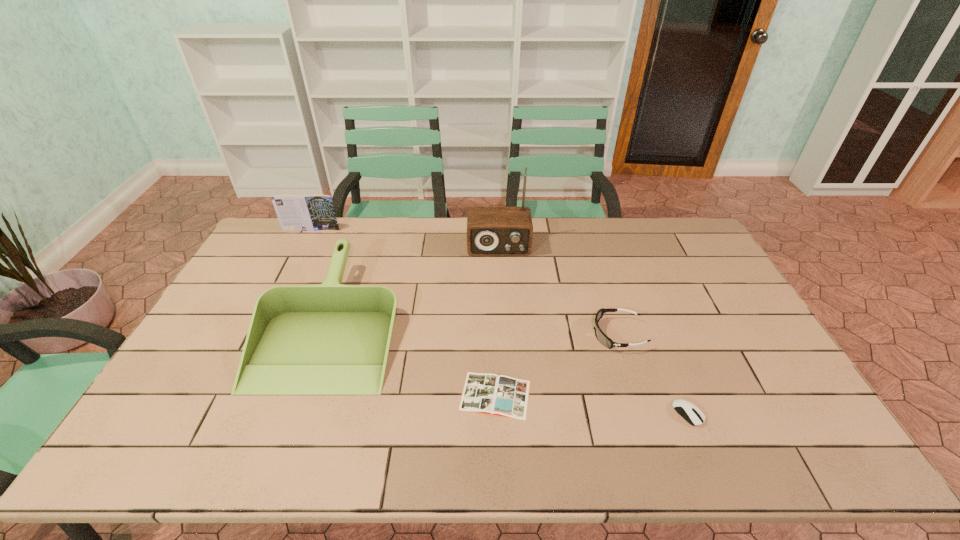
Locate an element on the screen. book situated at the far edge is located at coordinates (314, 212).

Locate an element on the screen. The height and width of the screenshot is (540, 960). book that is at the left edge is located at coordinates (314, 212).

Locate an element on the screen. The image size is (960, 540). dustpan located in the left edge section of the desktop is located at coordinates (329, 339).

This screenshot has width=960, height=540. Identify the location of object at the far left corner. (314, 212).

Find the location of `vacant space at the far edge of the desktop`. vacant space at the far edge of the desktop is located at coordinates (302, 246).

Find the location of a particular element. The image size is (960, 540). vacant space at the near edge of the desktop is located at coordinates (399, 443).

Locate an element on the screen. The height and width of the screenshot is (540, 960). free space at the left edge of the desktop is located at coordinates (176, 393).

Identify the location of free space at the right edge of the desktop. This screenshot has height=540, width=960. (736, 327).

Locate an element on the screen. The width and height of the screenshot is (960, 540). vacant space at the far right corner of the desktop is located at coordinates (649, 224).

At what (x,y) coordinates should I click in order to perform the action: click on free space between the left book and the fifth object from left to right. Please return your answer as a coordinate pair (x, y). Looking at the image, I should click on (465, 282).